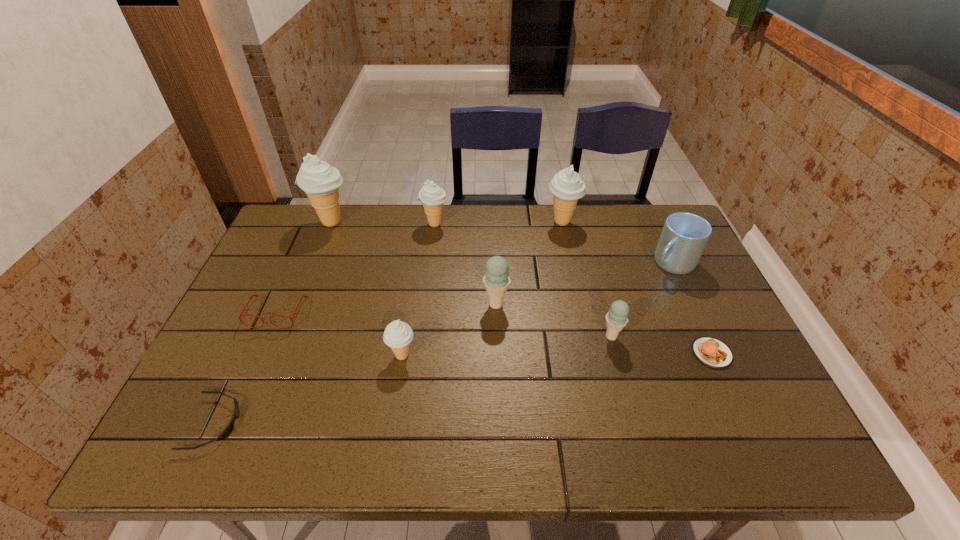
Identify the location of empty location between the second biggest beige icecream and the farther blue ice cream. (529, 263).

I want to click on free area in between the nearest beige icecream and the sixth object from left to right, so click(449, 330).

Identify the location of object that ranks as the closest to the sunglasses. The width and height of the screenshot is (960, 540). (240, 315).

At what (x,y) coordinates should I click in order to perform the action: click on object that is the second closest to the seventh nearest object. Please return your answer as a coordinate pair (x, y). Looking at the image, I should click on (713, 353).

Image resolution: width=960 pixels, height=540 pixels. I want to click on icecream that is the closest to the fourth farthest icecream, so click(x=398, y=335).

Locate an element on the screen. This screenshot has width=960, height=540. the second closest icecream relative to the patty is located at coordinates (496, 280).

Image resolution: width=960 pixels, height=540 pixels. Find the location of `the third closest beige icecream to the shortest object`. the third closest beige icecream to the shortest object is located at coordinates (433, 197).

Locate an element on the screen. the second closest beige icecream relative to the mug is located at coordinates (433, 197).

Locate an element on the screen. This screenshot has width=960, height=540. vacant region that satisfies the following two spatial constraints: 1. on the face of the spectacles; 2. on the front-facing side of the nearest object is located at coordinates (228, 423).

The image size is (960, 540). In order to click on free space that satisfies the following two spatial constraints: 1. on the front side of the patty; 2. on the left side of the smaller blue ice cream in this screenshot , I will do `click(615, 353)`.